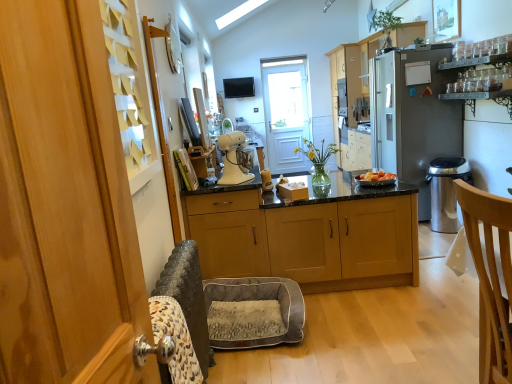
At what (x,y) coordinates should I click in order to perform the action: click on vacant area that is situated to the right of gray fabric cat bed at lower left. Please return your answer as a coordinate pair (x, y). Looking at the image, I should click on (347, 326).